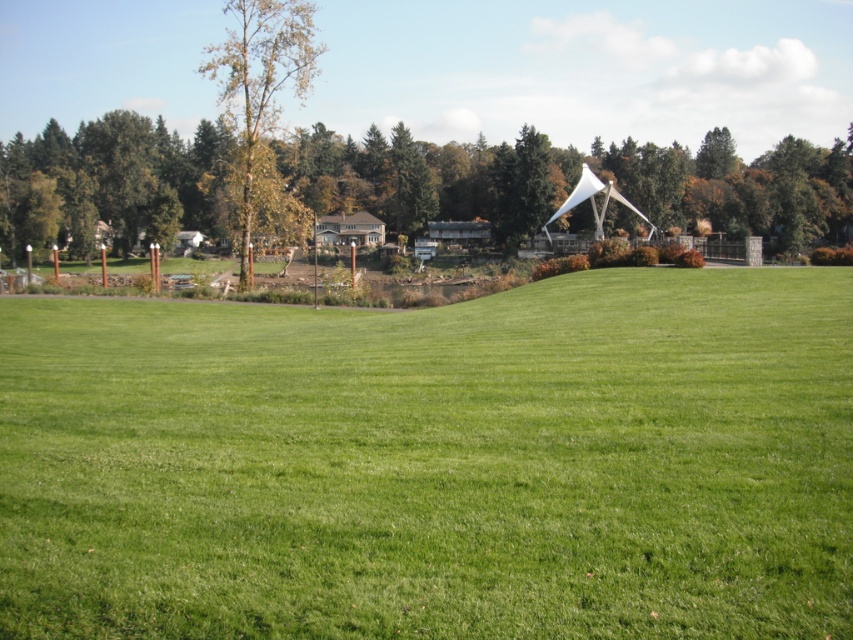
You are a drone operator trying to capture a photo of the brown wood tree at upper center. The camera is currently positioned at point 0.287, 0.649. Is the camera already aligned to the tree?

The 2D location of brown wood tree at upper center is at point (x=553, y=182), so yes, the camera is already aligned to the tree.

You are standing in the middle of the green grass at center and want to walk towards the green matte tree at upper center. Which direction should you move to reach the tree?

The green grass at center is positioned on the left side of the green matte tree at upper center, so you should move to the right to reach the tree.